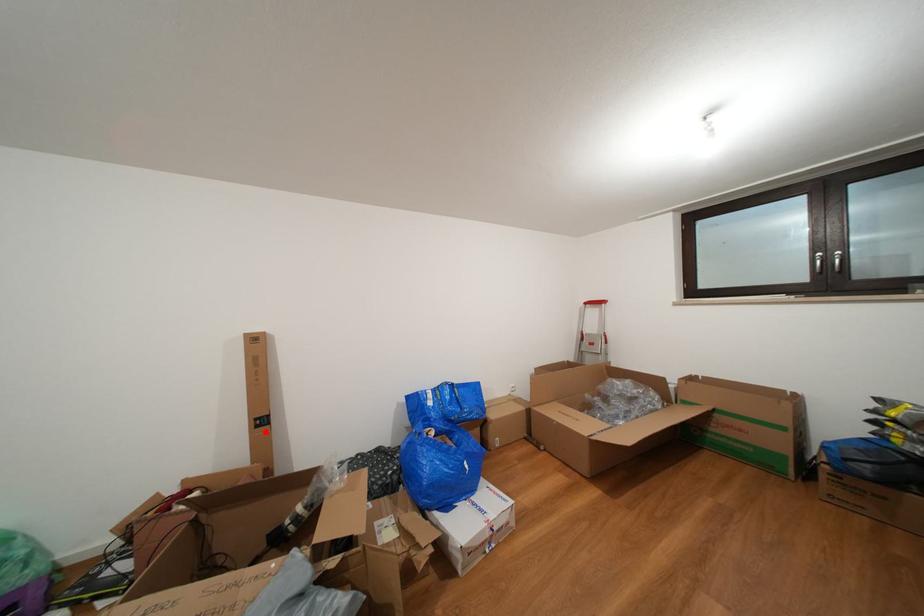
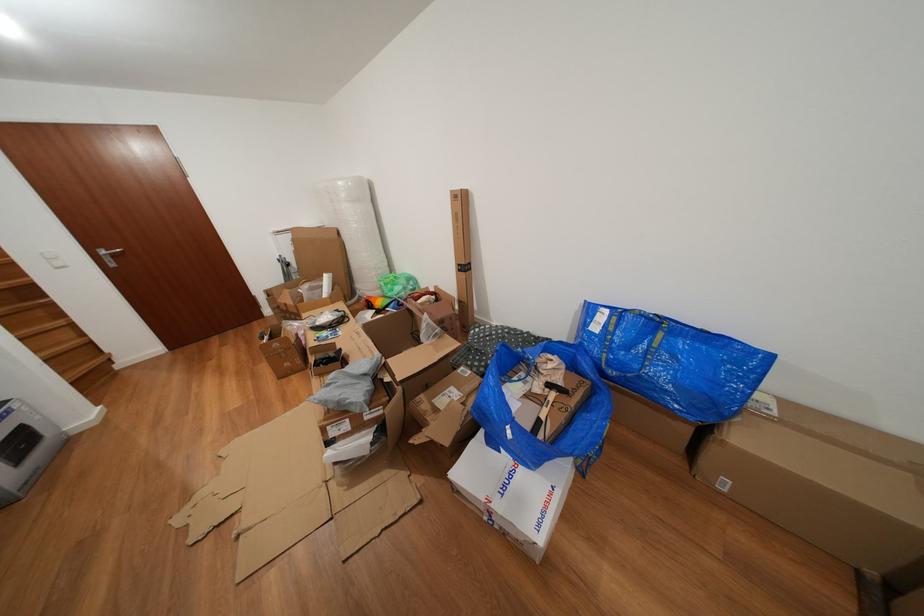
Question: I am providing you with two images of the same scene from different viewpoints. A red point is shown in image1. For the corresponding object point in image2, is it positioned nearer or farther from the camera?

Choices:
 (A) Nearer
 (B) Farther

Answer: (A)